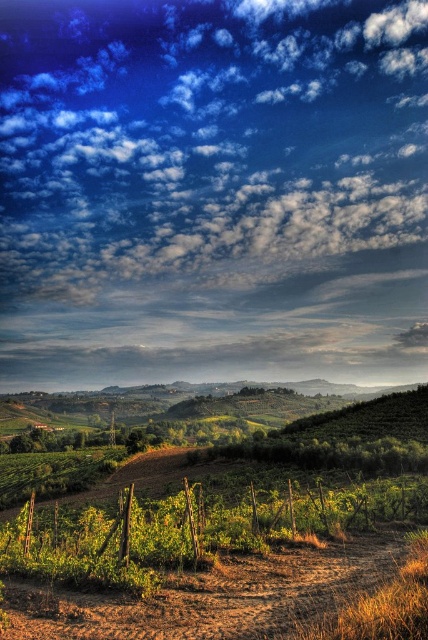
Question: Which point is farther from the camera taking this photo?

Choices:
 (A) (404, 276)
 (B) (73, 573)

Answer: (A)

Question: Does cloudy sky at upper center appear on the right side of green wire fence at lower center?

Choices:
 (A) yes
 (B) no

Answer: (B)

Question: Is cloudy sky at upper center to the left of green wire fence at lower center from the viewer's perspective?

Choices:
 (A) no
 (B) yes

Answer: (B)

Question: Can you confirm if cloudy sky at upper center is positioned above green wire fence at lower center?

Choices:
 (A) no
 (B) yes

Answer: (B)

Question: Among these objects, which one is farthest from the camera?

Choices:
 (A) cloudy sky at upper center
 (B) green wire fence at lower center

Answer: (A)